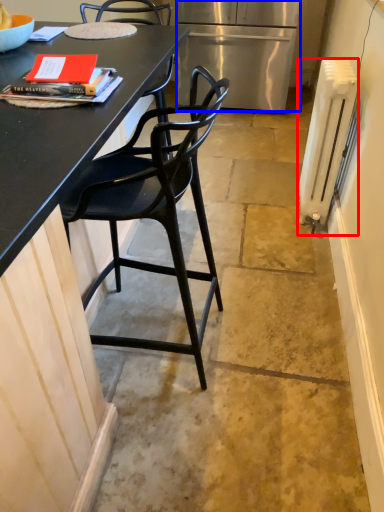
Question: Which object is closer to the camera taking this photo, radiator (highlighted by a red box) or refrigerator (highlighted by a blue box)?

Choices:
 (A) radiator
 (B) refrigerator

Answer: (A)